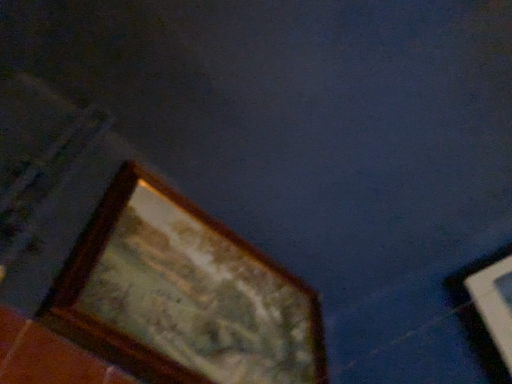
The height and width of the screenshot is (384, 512). What are the coordinates of `wooden picture frame at lower left` in the screenshot? It's located at (182, 295).

This screenshot has width=512, height=384. Describe the element at coordinates (182, 295) in the screenshot. I see `wooden picture frame at lower left` at that location.

Identify the location of wooden picture frame at lower left. This screenshot has height=384, width=512. (182, 295).